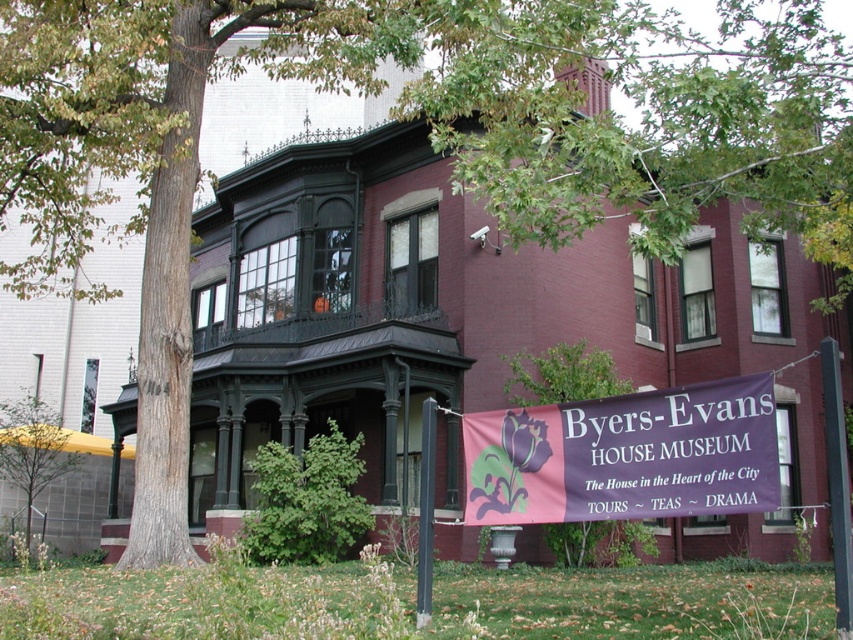
Question: Does purple fabric banner at center appear on the left side of green leafy tree at lower left?

Choices:
 (A) yes
 (B) no

Answer: (B)

Question: Does green leafy tree at center come behind green leafy tree at lower left?

Choices:
 (A) yes
 (B) no

Answer: (B)

Question: Estimate the real-world distances between objects in this image. Which object is farther from the purple fabric banner at center?

Choices:
 (A) green leafy tree at lower left
 (B) green leafy tree at center
 (C) black wrought iron porch at upper center

Answer: (A)

Question: Is green leafy tree at center above black wrought iron porch at upper center?

Choices:
 (A) yes
 (B) no

Answer: (B)

Question: Based on their relative distances, which object is nearer to the purple fabric banner at center?

Choices:
 (A) green leafy tree at lower left
 (B) black wrought iron porch at upper center
 (C) green leafy tree at center

Answer: (C)

Question: Among these objects, which one is nearest to the camera?

Choices:
 (A) green leafy tree at lower left
 (B) black wrought iron porch at upper center
 (C) purple fabric banner at center
 (D) green leafy tree at center

Answer: (C)